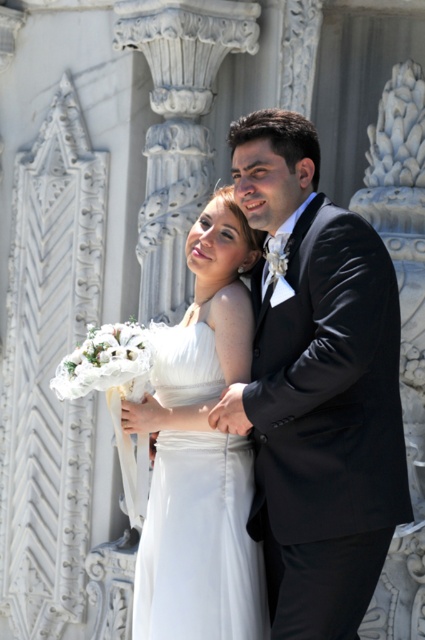
Question: Can you confirm if shiny black suit at center is positioned below white satin dress at center?

Choices:
 (A) no
 (B) yes

Answer: (A)

Question: Does shiny black suit at center come behind white satin dress at center?

Choices:
 (A) yes
 (B) no

Answer: (B)

Question: Is shiny black suit at center positioned behind white satin dress at center?

Choices:
 (A) yes
 (B) no

Answer: (B)

Question: Which object appears farthest from the camera in this image?

Choices:
 (A) white satin dress at center
 (B) shiny black suit at center

Answer: (A)